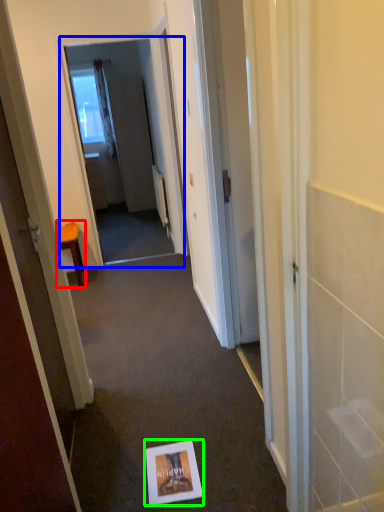
Question: Based on their relative distances, which object is nearer to furniture (highlighted by a red box)? Choose from screen door (highlighted by a blue box) and postcard (highlighted by a green box).

Choices:
 (A) screen door
 (B) postcard

Answer: (A)